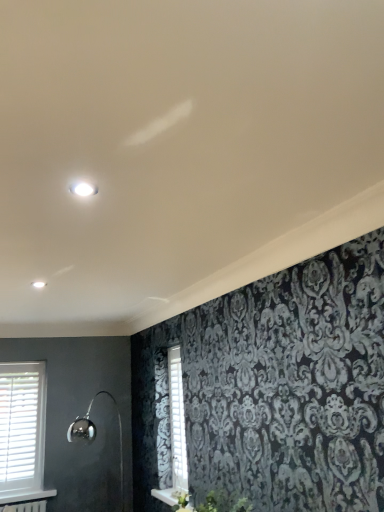
At what (x,y) coordinates should I click in order to perform the action: click on polished chrome shower at lower left. Please return your answer as a coordinate pair (x, y). Looking at the image, I should click on (95, 434).

The width and height of the screenshot is (384, 512). Describe the element at coordinates (177, 420) in the screenshot. I see `white wooden shutter at center` at that location.

Measure the distance between white wooden shutter at center and camera.

The distance of white wooden shutter at center from camera is 3.39 meters.

In order to click on polished chrome shower at lower left in this screenshot , I will do pyautogui.click(x=95, y=434).

From the image's perspective, who appears lower, polished chrome shower at lower left or white wooden shutter at center?

polished chrome shower at lower left is shown below in the image.

From their relative heights in the image, would you say polished chrome shower at lower left is taller or shorter than white wooden shutter at center?

Considering their sizes, polished chrome shower at lower left has more height than white wooden shutter at center.

Does point (117, 406) lie behind point (176, 422)?

That is True.

Considering the sizes of white wooden window at lower left and polished chrome shower at lower left in the image, is white wooden window at lower left bigger or smaller than polished chrome shower at lower left?

In the image, white wooden window at lower left appears to be smaller than polished chrome shower at lower left.

Is white wooden window at lower left inside the boundaries of polished chrome shower at lower left, or outside?

white wooden window at lower left is located beyond the bounds of polished chrome shower at lower left.

Considering the relative positions of white wooden window at lower left and polished chrome shower at lower left in the image provided, is white wooden window at lower left to the left of polished chrome shower at lower left from the viewer's perspective?

Indeed, white wooden window at lower left is positioned on the left side of polished chrome shower at lower left.

From a real-world perspective, is white wooden window at lower left above or below white wooden shutter at center?

Clearly, from a real-world perspective, white wooden window at lower left is below white wooden shutter at center.

From the image's perspective, would you say white wooden window at lower left is positioned over white wooden shutter at center?

No, from the image's perspective, white wooden window at lower left is not on top of white wooden shutter at center.

Would you say white wooden shutter at center is part of white wooden window at lower left's contents?

No, white wooden window at lower left does not contain white wooden shutter at center.

Find the location of a particular element. shutter in front of the white wooden window at lower left is located at coordinates (177, 420).

Can you confirm if white wooden shutter at center is wider than white wooden window at lower left?

In fact, white wooden shutter at center might be narrower than white wooden window at lower left.

From a real-world perspective, which object stands above the other?

From a 3D spatial view, white wooden shutter at center is above.

Where is `window that appears below the white wooden shutter at center (from the image's perspective)`? Image resolution: width=384 pixels, height=512 pixels. window that appears below the white wooden shutter at center (from the image's perspective) is located at coordinates (22, 431).

Considering the positions of points (177, 396) and (0, 400), is point (177, 396) farther from camera compared to point (0, 400)?

No, (177, 396) is in front of (0, 400).

Is point (170, 389) less distant than point (87, 426)?

Yes, it is.

Is polished chrome shower at lower left surrounded by white wooden shutter at center?

No, white wooden shutter at center does not contain polished chrome shower at lower left.

Looking at the image, does white wooden shutter at center seem bigger or smaller compared to polished chrome shower at lower left?

Considering their sizes, white wooden shutter at center takes up less space than polished chrome shower at lower left.

Would you say polished chrome shower at lower left is to the left or to the right of white wooden window at lower left in the picture?

Clearly, polished chrome shower at lower left is on the right of white wooden window at lower left in the image.

Is polished chrome shower at lower left closer to the viewer compared to white wooden window at lower left?

Yes, polished chrome shower at lower left is in front of white wooden window at lower left.

In the scene shown: Is polished chrome shower at lower left facing away from white wooden window at lower left?

No, polished chrome shower at lower left's orientation is not away from white wooden window at lower left.

Considering the positions of points (83, 421) and (20, 474), is point (83, 421) farther from camera compared to point (20, 474)?

Yes, it is.

You are a GUI agent. You are given a task and a screenshot of the screen. Output one action in this format:
    pyautogui.click(x=<x>, y=<y>)
    Task: Click on the shutter that appears on the right of polished chrome shower at lower left
    The image size is (384, 512).
    Given the screenshot: What is the action you would take?
    pyautogui.click(x=177, y=420)

This screenshot has height=512, width=384. Find the location of `shower in front of the white wooden window at lower left`. shower in front of the white wooden window at lower left is located at coordinates (95, 434).

Based on their spatial positions, is white wooden window at lower left or polished chrome shower at lower left closer to white wooden shutter at center?

Based on the image, polished chrome shower at lower left appears to be nearer to white wooden shutter at center.

From the picture: Looking at the image, which one is located closer to white wooden shutter at center, polished chrome shower at lower left or white wooden window at lower left?

polished chrome shower at lower left lies closer to white wooden shutter at center than the other object.

Which object lies further to the anchor point polished chrome shower at lower left, white wooden shutter at center or white wooden window at lower left?

Among the two, white wooden shutter at center is located further to polished chrome shower at lower left.

From the image, which object appears to be nearer to polished chrome shower at lower left, white wooden window at lower left or white wooden shutter at center?

white wooden window at lower left is closer to polished chrome shower at lower left.

Considering their positions, is white wooden shutter at center positioned closer to white wooden window at lower left than polished chrome shower at lower left?

Based on the image, polished chrome shower at lower left appears to be nearer to white wooden window at lower left.

Looking at the image, which one is located closer to white wooden window at lower left, polished chrome shower at lower left or white wooden shutter at center?

Based on the image, polished chrome shower at lower left appears to be nearer to white wooden window at lower left.

The image size is (384, 512). I want to click on shower between white wooden window at lower left and white wooden shutter at center, so click(x=95, y=434).